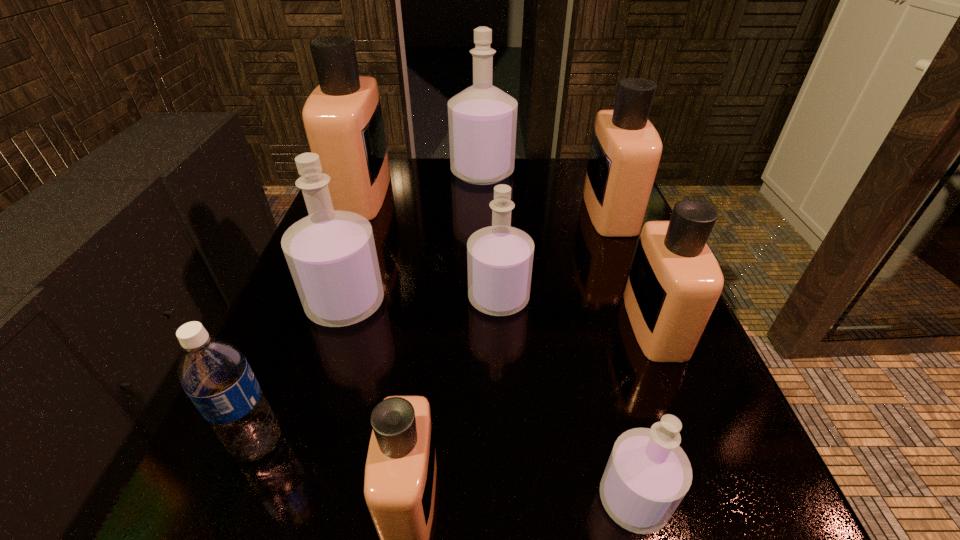
The width and height of the screenshot is (960, 540). Identify the location of vacant space at the far right corner of the desktop. (579, 194).

Locate an element on the screen. free space at the near right corner is located at coordinates (734, 539).

Find the location of a particular element. This screenshot has height=540, width=960. vacant point located between the second biggest purple perfume and the farthest purple perfume is located at coordinates (414, 238).

Identify the location of free area in between the leftmost beige perfume and the second biggest beige perfume. This screenshot has height=540, width=960. (486, 202).

The width and height of the screenshot is (960, 540). Find the location of `free space that is in between the third biggest purple perfume and the biggest beige perfume`. free space that is in between the third biggest purple perfume and the biggest beige perfume is located at coordinates (430, 246).

Identify the location of blank region between the second smallest purple perfume and the third smallest beige perfume. The height and width of the screenshot is (540, 960). (554, 255).

The height and width of the screenshot is (540, 960). I want to click on free spot between the third biggest beige perfume and the third biggest purple perfume, so (577, 311).

Identify the location of object that is the third nearest to the water bottle. Image resolution: width=960 pixels, height=540 pixels. (499, 258).

Identify which object is the sixth nearest to the second beige perfume from left to right. Please provide its 2D coordinates. Your answer should be formatted as a tuple, i.e. [(x, y)], where the tuple contains the x and y coordinates of a point satisfying the conditions above.

[(342, 117)]

Locate which perfume ranks in proximity to the second smallest beige perfume. Please provide its 2D coordinates. Your answer should be formatted as a tuple, i.e. [(x, y)], where the tuple contains the x and y coordinates of a point satisfying the conditions above.

[(499, 258)]